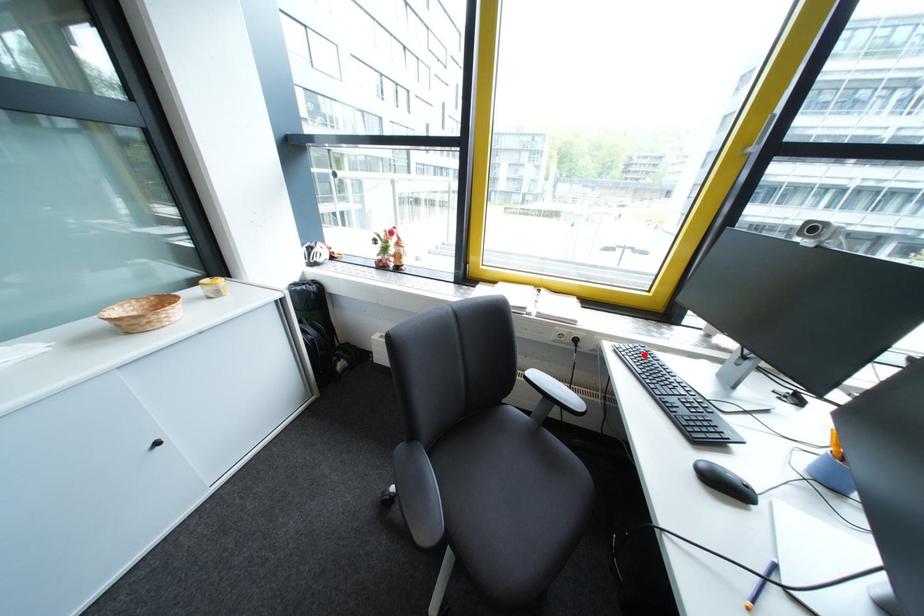
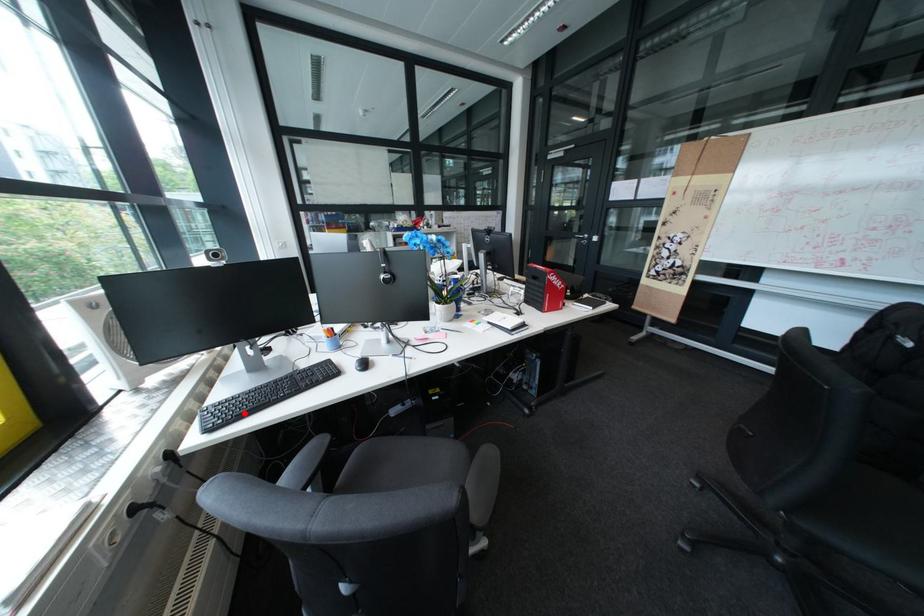
I am providing you with two images of the same scene from different viewpoints. A red point is marked on the first image and another point is marked on the second image. Does the point marked in image1 correspond to the same location as the one in image2?

Yes